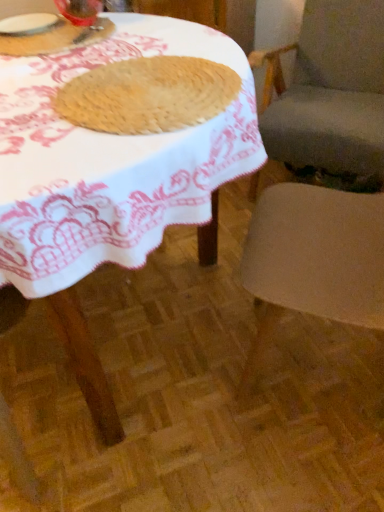
Image resolution: width=384 pixels, height=512 pixels. I want to click on free point in front of transparent glass at upper left, the 1th tableware from the right, so click(x=77, y=39).